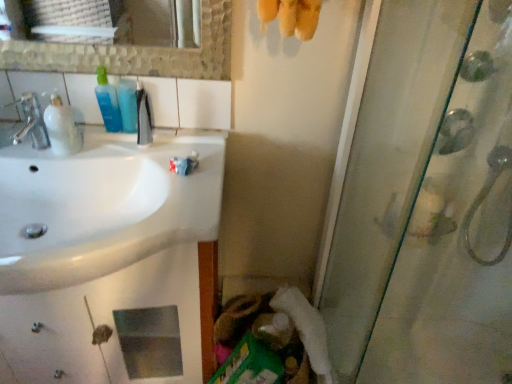
The height and width of the screenshot is (384, 512). What are the coordinates of `matte silver faucet at left` in the screenshot? It's located at (32, 122).

The height and width of the screenshot is (384, 512). What do you see at coordinates (144, 118) in the screenshot?
I see `black plastic toothbrush at upper center, arranged as the fourth mouthwash when viewed from the left` at bounding box center [144, 118].

In order to face white fluffy toilet paper at lower center, should I rotate leftwards or rightwards?

To align with it, rotate right about 6.059°.

What do you see at coordinates (426, 202) in the screenshot? I see `transparent glass shower door at right` at bounding box center [426, 202].

Based on the photo, measure the distance between translucent plastic mouthwash at left, which is counted as the 1th mouthwash, starting from the left, and camera.

The depth of translucent plastic mouthwash at left, which is counted as the 1th mouthwash, starting from the left, is 1.07 meters.

This screenshot has width=512, height=384. What are the coordinates of `matte silver faucet at left` in the screenshot? It's located at (32, 122).

Considering the relative sizes of black plastic toothbrush at upper center, arranged as the fourth mouthwash when viewed from the left, and blue translucent bottle at upper left, which is the 2th mouthwash from right to left, in the image provided, is black plastic toothbrush at upper center, arranged as the fourth mouthwash when viewed from the left, wider than blue translucent bottle at upper left, which is the 2th mouthwash from right to left,?

Incorrect, the width of black plastic toothbrush at upper center, arranged as the fourth mouthwash when viewed from the left, does not surpass that of blue translucent bottle at upper left, which is the 2th mouthwash from right to left.

Does black plastic toothbrush at upper center, arranged as the fourth mouthwash when viewed from the left, turn towards blue translucent bottle at upper left, which is the 2th mouthwash from right to left?

No, black plastic toothbrush at upper center, arranged as the fourth mouthwash when viewed from the left, does not turn towards blue translucent bottle at upper left, which is the 2th mouthwash from right to left.

Considering the points (147, 131) and (129, 123), which point is in front, point (147, 131) or point (129, 123)?

The point (129, 123) is closer to the camera.

From the image's perspective, who appears lower, black plastic toothbrush at upper center, positioned as the first mouthwash in right-to-left order, or blue translucent bottle at upper left, which is the 2th mouthwash from right to left?

black plastic toothbrush at upper center, positioned as the first mouthwash in right-to-left order, from the image's perspective.

Does blue translucent bottle at upper left, acting as the 2th mouthwash starting from the left, have a lesser height compared to white glossy sink at left?

Yes, blue translucent bottle at upper left, acting as the 2th mouthwash starting from the left, is shorter than white glossy sink at left.

Considering the sizes of objects blue translucent bottle at upper left, the 3th mouthwash when ordered from right to left, and white glossy sink at left in the image provided, who is thinner, blue translucent bottle at upper left, the 3th mouthwash when ordered from right to left, or white glossy sink at left?

blue translucent bottle at upper left, the 3th mouthwash when ordered from right to left, is thinner.

Considering the points (103, 82) and (162, 195), which point is in front, point (103, 82) or point (162, 195)?

The point (162, 195) is closer to the camera.

From the picture: Is black plastic toothbrush at upper center, arranged as the fourth mouthwash when viewed from the left, inside the boundaries of translucent plastic mouthwash at left, which is counted as the 1th mouthwash, starting from the left, or outside?

black plastic toothbrush at upper center, arranged as the fourth mouthwash when viewed from the left, cannot be found inside translucent plastic mouthwash at left, which is counted as the 1th mouthwash, starting from the left.

Based on the photo, can you tell me how much black plastic toothbrush at upper center, positioned as the first mouthwash in right-to-left order, and translucent plastic mouthwash at left, acting as the fourth mouthwash starting from the right, differ in facing direction?

The angular difference between black plastic toothbrush at upper center, positioned as the first mouthwash in right-to-left order, and translucent plastic mouthwash at left, acting as the fourth mouthwash starting from the right, is 2.46 degrees.

Is black plastic toothbrush at upper center, positioned as the first mouthwash in right-to-left order, positioned with its back to translucent plastic mouthwash at left, acting as the fourth mouthwash starting from the right?

No.

Between point (142, 113) and point (53, 110), which one is positioned in front?

The point (53, 110) is in front.

From the image's perspective, is blue translucent bottle at upper left, the 3th mouthwash when ordered from right to left, above or below black plastic toothbrush at upper center, arranged as the fourth mouthwash when viewed from the left?

From the image's perspective, blue translucent bottle at upper left, the 3th mouthwash when ordered from right to left, appears above black plastic toothbrush at upper center, arranged as the fourth mouthwash when viewed from the left.

Is blue translucent bottle at upper left, the 3th mouthwash when ordered from right to left, not inside black plastic toothbrush at upper center, positioned as the first mouthwash in right-to-left order?

Yes.

From a real-world perspective, between blue translucent bottle at upper left, acting as the 2th mouthwash starting from the left, and black plastic toothbrush at upper center, arranged as the fourth mouthwash when viewed from the left, who is vertically higher?

From a 3D spatial view, blue translucent bottle at upper left, acting as the 2th mouthwash starting from the left, is above.

Based on the photo, which object is closer to the camera, blue translucent bottle at upper left, the 3th mouthwash when ordered from right to left, or black plastic toothbrush at upper center, arranged as the fourth mouthwash when viewed from the left?

black plastic toothbrush at upper center, arranged as the fourth mouthwash when viewed from the left.

Does white glossy sink at left lie in front of white fluffy toilet paper at lower center?

Yes, it is in front of white fluffy toilet paper at lower center.

From a real-world perspective, which is physically above, white glossy sink at left or white fluffy toilet paper at lower center?

In real-world perspective, white glossy sink at left is above.

Which object is positioned more to the right, white glossy sink at left or white fluffy toilet paper at lower center?

Positioned to the right is white fluffy toilet paper at lower center.

Who is smaller, white glossy sink at left or white fluffy toilet paper at lower center?

white fluffy toilet paper at lower center.

From the image's perspective, which is below, transparent glass shower door at right or black plastic toothbrush at upper center, positioned as the first mouthwash in right-to-left order?

From the image's view, transparent glass shower door at right is below.

Find the location of `screen door below the black plastic toothbrush at upper center, positioned as the first mouthwash in right-to-left order (from a real-world perspective)`. screen door below the black plastic toothbrush at upper center, positioned as the first mouthwash in right-to-left order (from a real-world perspective) is located at coordinates (426, 202).

Considering the positions of objects transparent glass shower door at right and black plastic toothbrush at upper center, positioned as the first mouthwash in right-to-left order, in the image provided, who is more to the right, transparent glass shower door at right or black plastic toothbrush at upper center, positioned as the first mouthwash in right-to-left order,?

From the viewer's perspective, transparent glass shower door at right appears more on the right side.

Is white fluffy toilet paper at lower center behind translucent plastic mouthwash at left, acting as the fourth mouthwash starting from the right?

Yes, white fluffy toilet paper at lower center is further from the viewer.

Is white fluffy toilet paper at lower center taller or shorter than translucent plastic mouthwash at left, acting as the fourth mouthwash starting from the right?

Clearly, white fluffy toilet paper at lower center is taller compared to translucent plastic mouthwash at left, acting as the fourth mouthwash starting from the right.

Is white fluffy toilet paper at lower center thinner than translucent plastic mouthwash at left, acting as the fourth mouthwash starting from the right?

In fact, white fluffy toilet paper at lower center might be wider than translucent plastic mouthwash at left, acting as the fourth mouthwash starting from the right.

Can you see white fluffy toilet paper at lower center touching translucent plastic mouthwash at left, which is counted as the 1th mouthwash, starting from the left?

No, white fluffy toilet paper at lower center is not next to translucent plastic mouthwash at left, which is counted as the 1th mouthwash, starting from the left.

Identify the location of mouthwash that is the 2nd one when counting backward from the black plastic toothbrush at upper center, positioned as the first mouthwash in right-to-left order. (128, 104).

Starting from the white glossy sink at left, which mouthwash is the 1st one to the right? Please provide its 2D coordinates.

[(108, 102)]

In the scene shown: Looking at the image, which one is located closer to blue translucent bottle at upper left, the 3th mouthwash when ordered from right to left, transparent glass shower door at right or translucent plastic mouthwash at left, which is counted as the 1th mouthwash, starting from the left?

translucent plastic mouthwash at left, which is counted as the 1th mouthwash, starting from the left.

When comparing their distances from blue translucent bottle at upper left, the 3th mouthwash when ordered from right to left, does white fluffy toilet paper at lower center or matte silver faucet at left seem further?

white fluffy toilet paper at lower center lies further to blue translucent bottle at upper left, the 3th mouthwash when ordered from right to left, than the other object.

When comparing their distances from white glossy sink at left, does matte silver faucet at left or black plastic toothbrush at upper center, arranged as the fourth mouthwash when viewed from the left, seem closer?

black plastic toothbrush at upper center, arranged as the fourth mouthwash when viewed from the left, is positioned closer to the anchor white glossy sink at left.

Considering their positions, is white fluffy toilet paper at lower center positioned closer to translucent plastic mouthwash at left, which is counted as the 1th mouthwash, starting from the left, than black plastic toothbrush at upper center, arranged as the fourth mouthwash when viewed from the left?

The object closer to translucent plastic mouthwash at left, which is counted as the 1th mouthwash, starting from the left, is black plastic toothbrush at upper center, arranged as the fourth mouthwash when viewed from the left.

Looking at this image, which object lies further to the anchor point white fluffy toilet paper at lower center, transparent glass shower door at right or matte silver faucet at left?

matte silver faucet at left is positioned further to the anchor white fluffy toilet paper at lower center.

Estimate the real-world distances between objects in this image. Which object is further from white glossy sink at left, blue translucent bottle at upper left, acting as the 2th mouthwash starting from the left, or translucent plastic mouthwash at left, which is counted as the 1th mouthwash, starting from the left?

blue translucent bottle at upper left, acting as the 2th mouthwash starting from the left, is further to white glossy sink at left.

Considering their positions, is black plastic toothbrush at upper center, arranged as the fourth mouthwash when viewed from the left, positioned closer to matte silver faucet at left than blue translucent bottle at upper left, which is the 3th mouthwash from left to right?

Among the two, blue translucent bottle at upper left, which is the 3th mouthwash from left to right, is located nearer to matte silver faucet at left.

Consider the image. Looking at the image, which one is located further to matte silver faucet at left, blue translucent bottle at upper left, acting as the 2th mouthwash starting from the left, or translucent plastic mouthwash at left, which is counted as the 1th mouthwash, starting from the left?

Based on the image, blue translucent bottle at upper left, acting as the 2th mouthwash starting from the left, appears to be further to matte silver faucet at left.

Where is `tap between white glossy sink at left and blue translucent bottle at upper left, the 3th mouthwash when ordered from right to left, from front to back`? tap between white glossy sink at left and blue translucent bottle at upper left, the 3th mouthwash when ordered from right to left, from front to back is located at coordinates (32, 122).

This screenshot has height=384, width=512. In order to click on tap between white glossy sink at left and black plastic toothbrush at upper center, positioned as the first mouthwash in right-to-left order, in the front-back direction in this screenshot , I will do coord(32,122).

Where is `tap positioned between white glossy sink at left and translucent plastic mouthwash at left, which is counted as the 1th mouthwash, starting from the left, from near to far`? The height and width of the screenshot is (384, 512). tap positioned between white glossy sink at left and translucent plastic mouthwash at left, which is counted as the 1th mouthwash, starting from the left, from near to far is located at coordinates (32, 122).

You are a GUI agent. You are given a task and a screenshot of the screen. Output one action in this format:
    pyautogui.click(x=<x>, y=<y>)
    Task: Click on the mouthwash between blue translucent bottle at upper left, the 3th mouthwash when ordered from right to left, and black plastic toothbrush at upper center, arranged as the fourth mouthwash when viewed from the left, from left to right
    This screenshot has height=384, width=512.
    Given the screenshot: What is the action you would take?
    pyautogui.click(x=128, y=104)